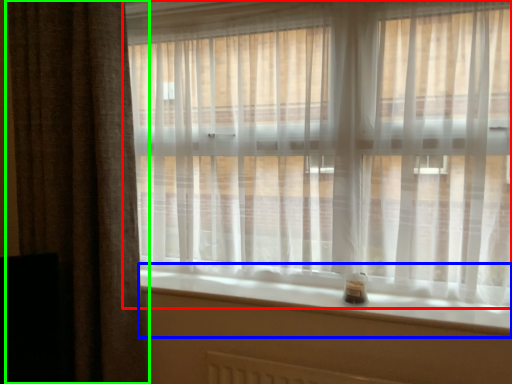
Question: Which object is the closest to the curtain (highlighted by a red box)? Choose among these: window sill (highlighted by a blue box) or curtain (highlighted by a green box).

Choices:
 (A) window sill
 (B) curtain

Answer: (A)